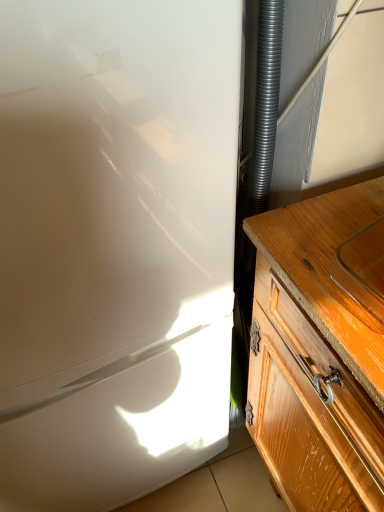
Where is `wooden cabinet at right`? wooden cabinet at right is located at coordinates (308, 411).

The image size is (384, 512). Describe the element at coordinates (308, 411) in the screenshot. I see `wooden cabinet at right` at that location.

The height and width of the screenshot is (512, 384). I want to click on wooden cabinet at right, so click(x=308, y=411).